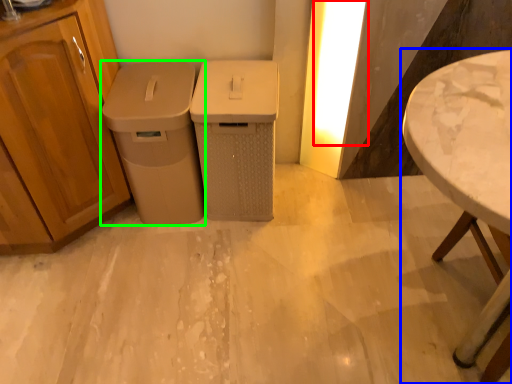
Question: Estimate the real-world distances between objects in this image. Which object is closer to light (highlighted by a red box), table (highlighted by a blue box) or waste container (highlighted by a green box)?

Choices:
 (A) table
 (B) waste container

Answer: (B)